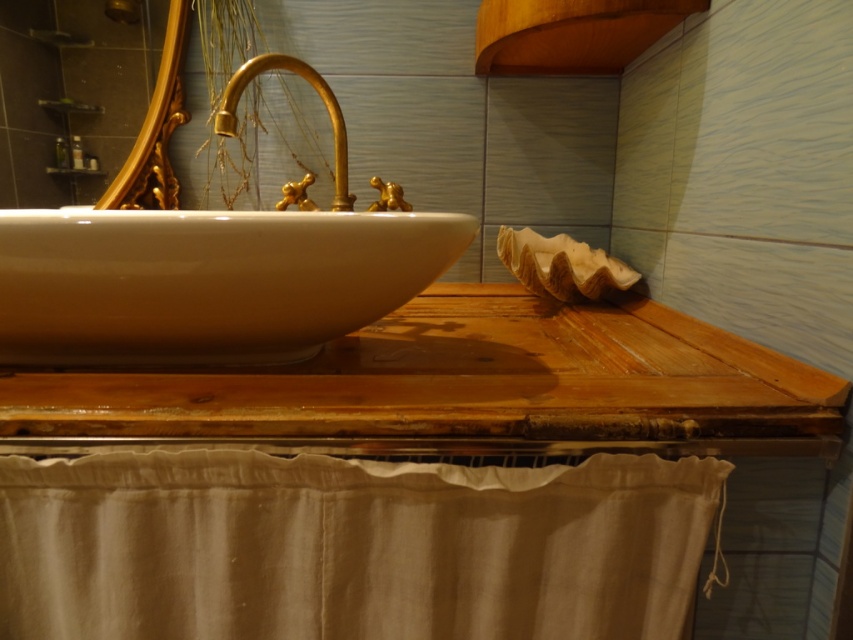
Question: Among these objects, which one is nearest to the camera?

Choices:
 (A) white glossy sink at center
 (B) gold polished faucet at center
 (C) wooden lampshade at upper right
 (D) wooden counter top at center

Answer: (D)

Question: Can you confirm if wooden counter top at center is wider than white glossy sink at center?

Choices:
 (A) no
 (B) yes

Answer: (B)

Question: Is wooden counter top at center behind white glossy sink at center?

Choices:
 (A) yes
 (B) no

Answer: (B)

Question: Does wooden counter top at center have a greater width compared to gold polished faucet at center?

Choices:
 (A) yes
 (B) no

Answer: (A)

Question: Which object appears farthest from the camera in this image?

Choices:
 (A) wooden counter top at center
 (B) beige cotton curtain at lower center

Answer: (B)

Question: Which point appears farthest from the camera in this image?

Choices:
 (A) (492, 67)
 (B) (326, 461)
 (C) (28, 212)

Answer: (A)